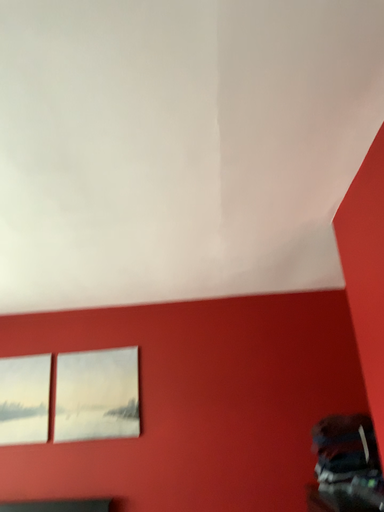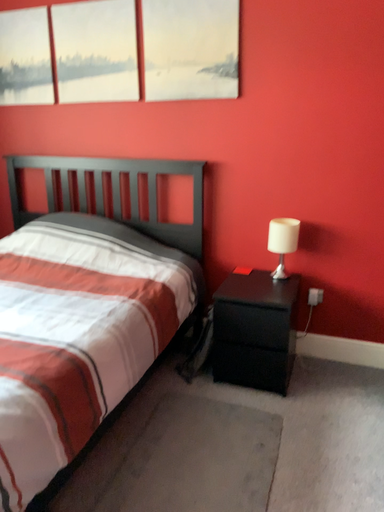
Question: How did the camera likely rotate when shooting the video?

Choices:
 (A) rotated downward
 (B) rotated upward

Answer: (A)